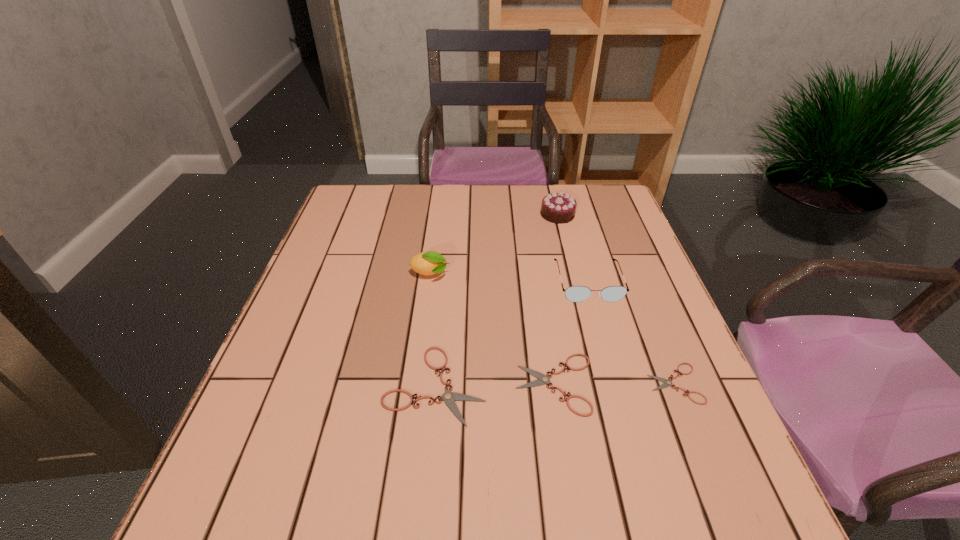
Where is `free point that keeps the shearss evenly spaced on the left`? Image resolution: width=960 pixels, height=540 pixels. free point that keeps the shearss evenly spaced on the left is located at coordinates (315, 385).